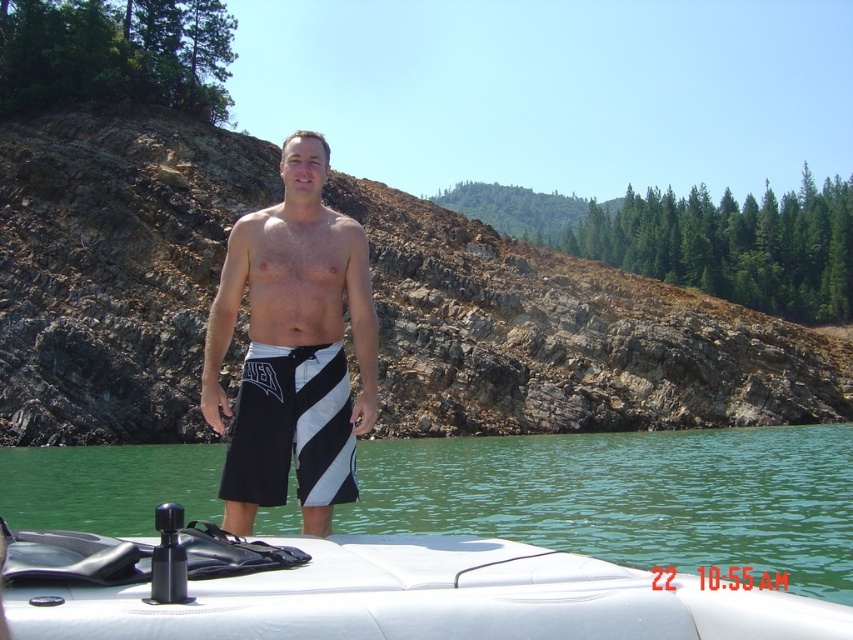
Question: Which object is the closest to the green water at center?

Choices:
 (A) black and white striped shorts at center
 (B) black/white striped shorts at center

Answer: (B)

Question: Can you confirm if green water at center is thinner than hairless skin at center?

Choices:
 (A) no
 (B) yes

Answer: (A)

Question: Can you confirm if white matte boat at center is positioned above black and white striped shorts at center?

Choices:
 (A) yes
 (B) no

Answer: (B)

Question: Which point is closer to the camera?

Choices:
 (A) (624, 596)
 (B) (262, 477)
 (C) (688, 502)

Answer: (A)

Question: Which object is positioned farthest from the black and white striped shorts at center?

Choices:
 (A) black/white striped shorts at center
 (B) green water at center
 (C) white matte boat at center

Answer: (B)

Question: Is black and white striped shorts at center bigger than hairless skin at center?

Choices:
 (A) yes
 (B) no

Answer: (B)